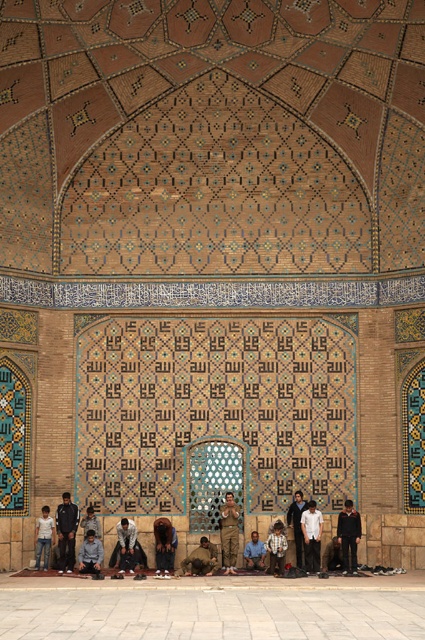
Which is more to the right, blue fabric shirt at center or dark brown leather jacket at center?

From the viewer's perspective, dark brown leather jacket at center appears more on the right side.

Can you confirm if blue fabric shirt at center is smaller than dark brown leather jacket at center?

Correct, blue fabric shirt at center occupies less space than dark brown leather jacket at center.

This screenshot has height=640, width=425. I want to click on blue fabric shirt at center, so click(x=255, y=552).

Where is `blue fabric shirt at center`? This screenshot has height=640, width=425. blue fabric shirt at center is located at coordinates (255, 552).

Is light brown leather shoes at lower center shorter than dark blue jeans at center?

Incorrect, light brown leather shoes at lower center's height does not fall short of dark blue jeans at center's.

Does light brown leather shoes at lower center appear on the left side of dark blue jeans at center?

Indeed, light brown leather shoes at lower center is positioned on the left side of dark blue jeans at center.

Find the location of a particular element. light brown leather shoes at lower center is located at coordinates (277, 548).

Locate an element on the screen. light brown leather shoes at lower center is located at coordinates (277, 548).

What do you see at coordinates (201, 560) in the screenshot? I see `camouflage fabric person at center` at bounding box center [201, 560].

Does camouflage fabric person at center have a lesser height compared to light gray fabric at lower center?

Incorrect, camouflage fabric person at center's height does not fall short of light gray fabric at lower center's.

Between point (215, 564) and point (93, 522), which one is positioned behind?

The point (93, 522) is behind.

Find the location of a particular element. camouflage fabric person at center is located at coordinates (201, 560).